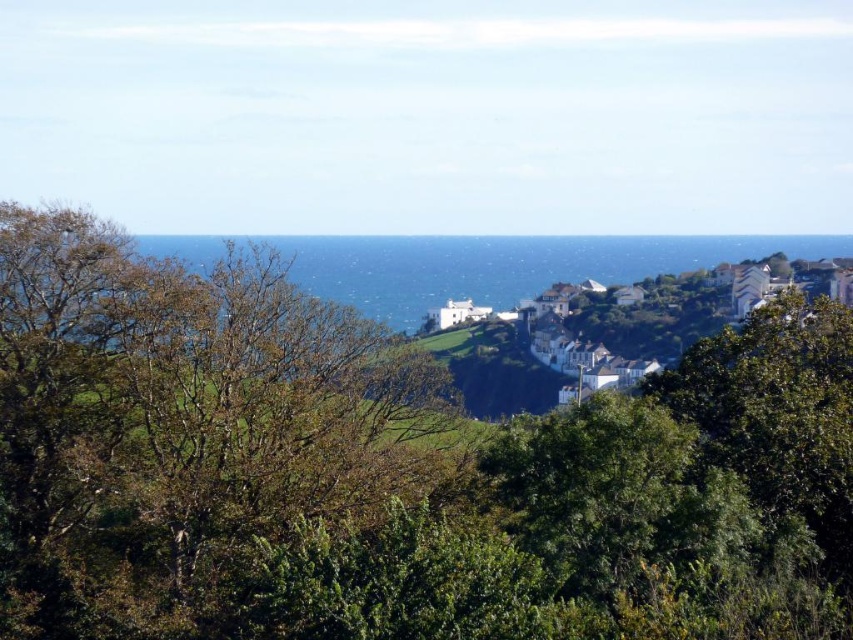
Is brown leafy tree at center bigger than white painted houses at center?

Incorrect, brown leafy tree at center is not larger than white painted houses at center.

Is brown leafy tree at center to the left of white painted houses at center from the viewer's perspective?

Yes, brown leafy tree at center is to the left of white painted houses at center.

This screenshot has height=640, width=853. Find the location of `brown leafy tree at center`. brown leafy tree at center is located at coordinates (181, 428).

Which is more to the left, blue water at center or white painted houses at center?

blue water at center is more to the left.

Which is below, blue water at center or white painted houses at center?

white painted houses at center is below.

Between point (521, 268) and point (688, 342), which one is positioned in front?

Point (688, 342) is in front.

The height and width of the screenshot is (640, 853). Identify the location of blue water at center. (503, 266).

Which is above, brown leafy tree at center or blue water at center?

blue water at center is higher up.

In the scene shown: Which of these two, brown leafy tree at center or blue water at center, stands taller?

Standing taller between the two is blue water at center.

Is point (236, 332) positioned in front of point (457, 272)?

Yes, point (236, 332) is in front of point (457, 272).

Locate an element on the screen. brown leafy tree at center is located at coordinates (181, 428).